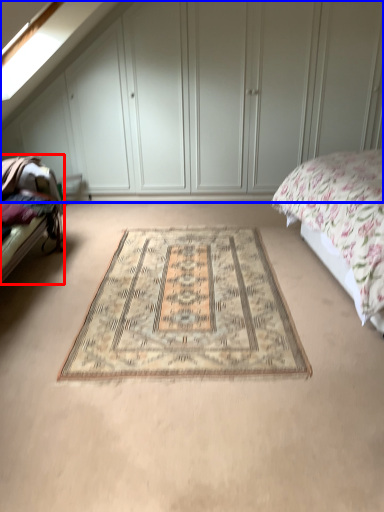
Question: Which object appears farthest to the camera in this image, bed frame (highlighted by a red box) or dresser (highlighted by a blue box)?

Choices:
 (A) bed frame
 (B) dresser

Answer: (B)